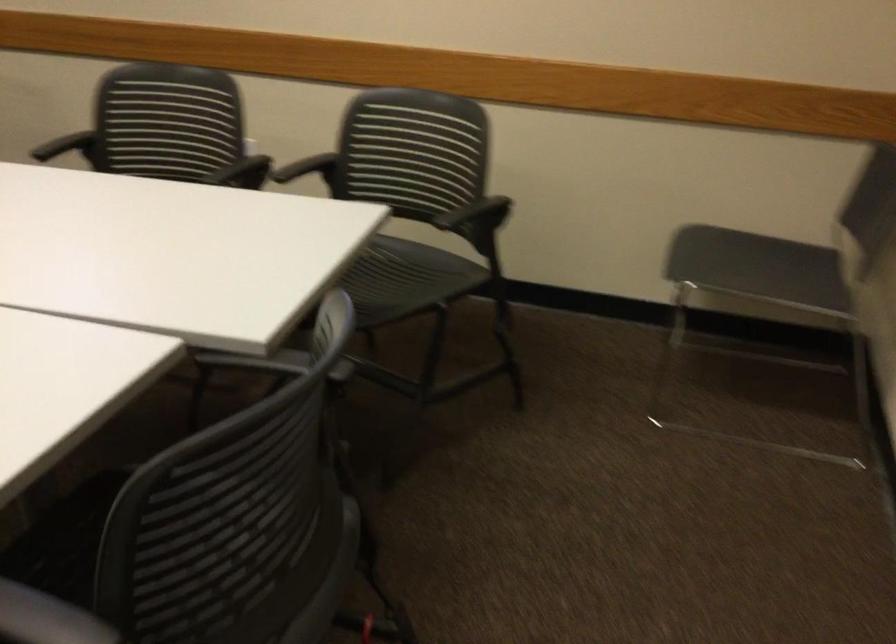
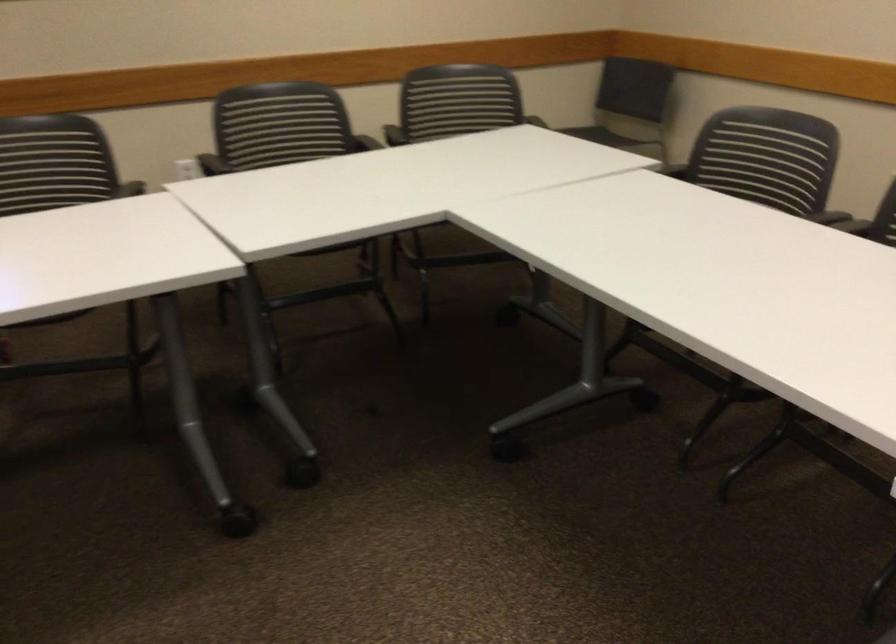
Locate, in the second image, the point that corresponds to point 270,161 in the first image.

(360, 142)